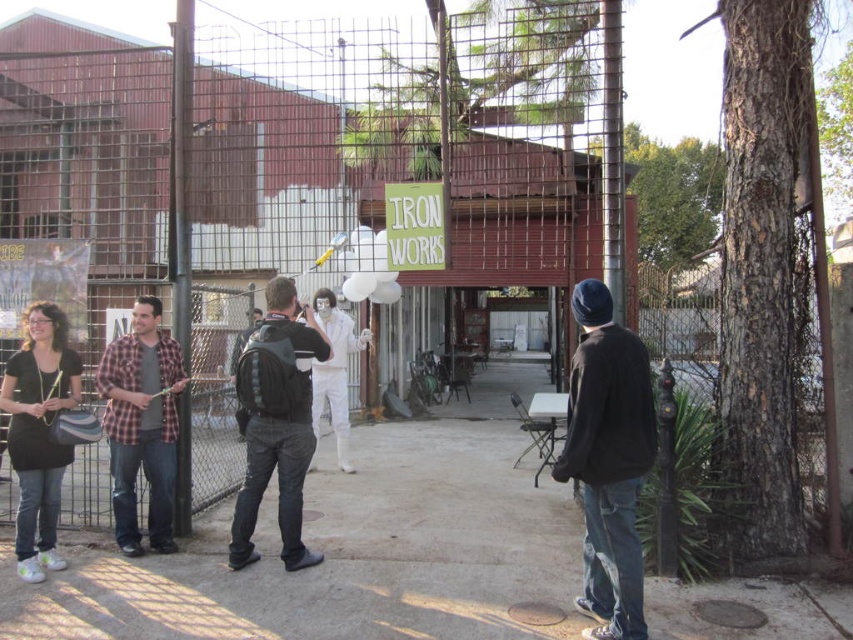
Question: Which of the following is the closest to the observer?

Choices:
 (A) dark blue knit cap at right
 (B) plaid flannel shirt at left

Answer: (A)

Question: Estimate the real-world distances between objects in this image. Which object is closer to the plaid flannel shirt at left?

Choices:
 (A) white matte suit at center
 (B) black backpack at center
 (C) dark blue knit cap at right

Answer: (B)

Question: Can you confirm if plaid flannel shirt at left is positioned below white matte suit at center?

Choices:
 (A) no
 (B) yes

Answer: (A)

Question: Is the position of dark blue knit cap at right more distant than that of matte black shirt at lower left?

Choices:
 (A) no
 (B) yes

Answer: (A)

Question: Is plaid flannel shirt at left closer to the viewer compared to white matte suit at center?

Choices:
 (A) no
 (B) yes

Answer: (B)

Question: Which object appears closest to the camera in this image?

Choices:
 (A) black backpack at center
 (B) matte black shirt at lower left
 (C) white matte suit at center
 (D) plaid flannel shirt at left

Answer: (A)